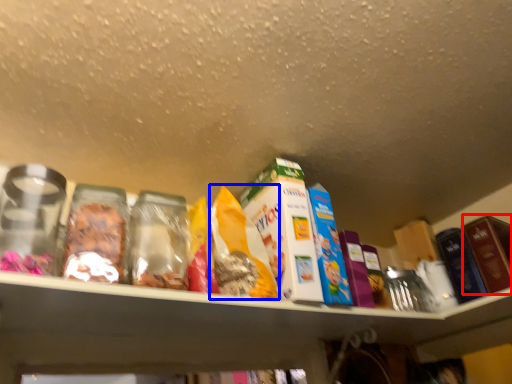
Question: Which object is closer to the camera taking this photo, product (highlighted by a red box) or cereal (highlighted by a blue box)?

Choices:
 (A) product
 (B) cereal

Answer: (B)